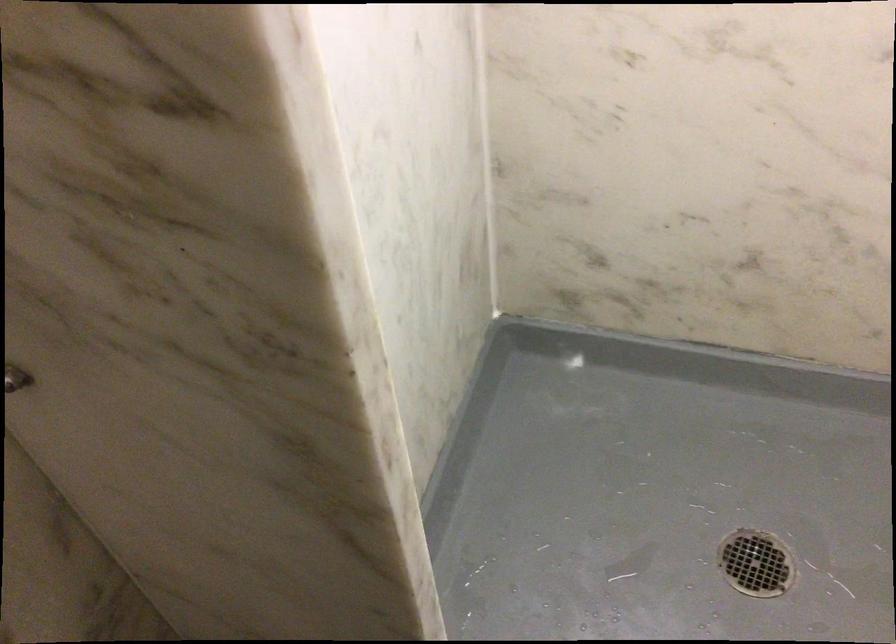
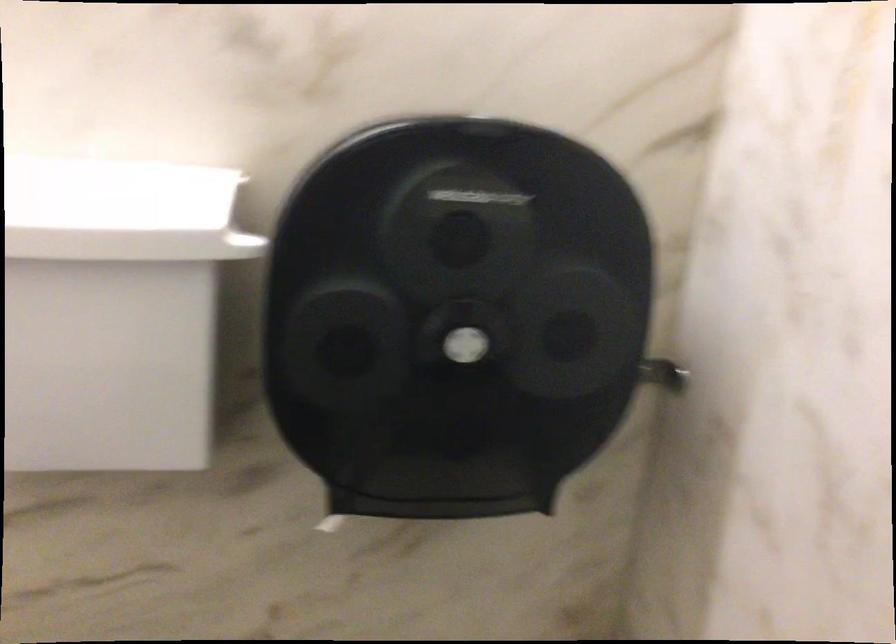
The first image is from the beginning of the video and the second image is from the end. How did the camera likely rotate when shooting the video?

The rotation direction of the camera is right-down.